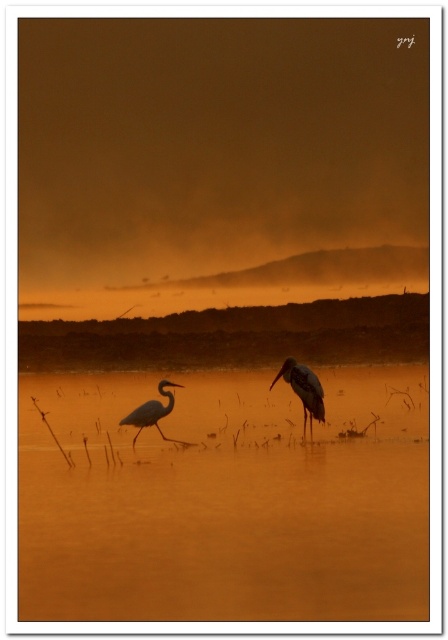
In the scene shown: You are an ornithologist observing two herons in a wetland area. You notice the smooth gray heron at center and the matte black heron at left. Which heron has a slimmer body structure according to their physical characteristics?

The smooth gray heron at center is thinner than the matte black heron at left, so it has a slimmer body structure.

You are an ornithologist observing the two herons in the image. Which heron is positioned higher in the scene, the smooth gray heron at center or the matte black heron at left?

The smooth gray heron at center is positioned higher than the matte black heron at left in the scene.

You are an observer trying to capture a photo of the golden smooth water at center and the smooth gray heron at center. Which object would appear larger in your camera viewfinder?

The golden smooth water at center would appear larger in the camera viewfinder because it is bigger than the smooth gray heron at center.